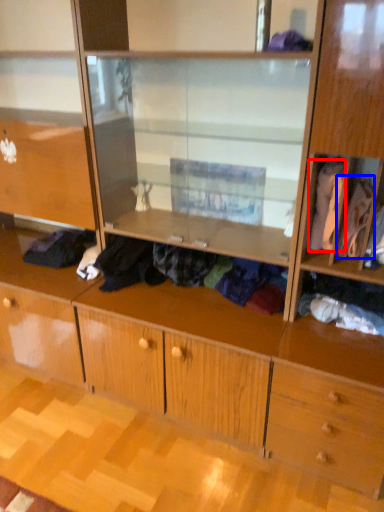
Question: Which of the following is the farthest to the observer, clothing (highlighted by a red box) or clothing (highlighted by a blue box)?

Choices:
 (A) clothing
 (B) clothing

Answer: (B)